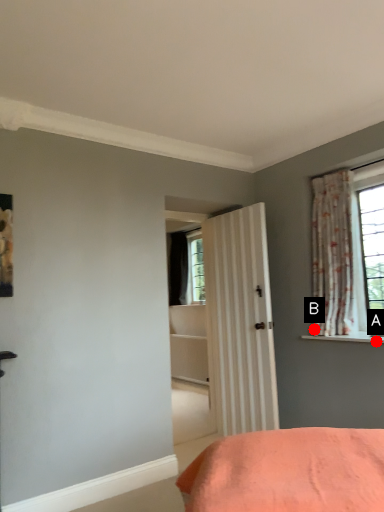
Question: Two points are circled on the image, labeled by A and B beside each circle. Which point is closer to the camera taking this photo?

Choices:
 (A) A is closer
 (B) B is closer

Answer: (A)